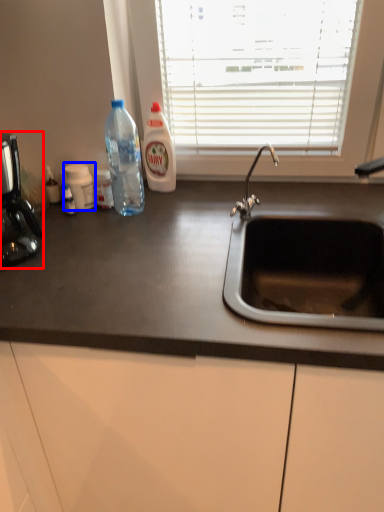
Question: Which object is closer to the camera taking this photo, coffee machine (highlighted by a red box) or bottle (highlighted by a blue box)?

Choices:
 (A) coffee machine
 (B) bottle

Answer: (A)